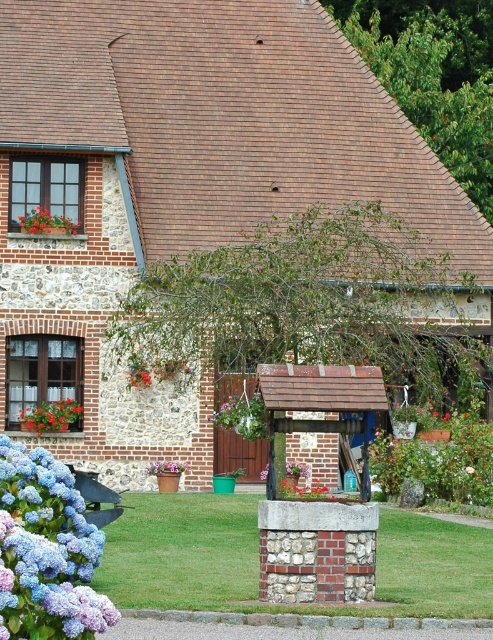
Question: Which object appears farthest from the camera in this image?

Choices:
 (A) green leafy bush at center
 (B) green grass at center
 (C) matte red flowers at upper left
 (D) purple matte hydrangea at lower left

Answer: (C)

Question: Does purple matte hydrangea at lower left lie in front of pink fabric flower at lower center?

Choices:
 (A) yes
 (B) no

Answer: (A)

Question: Can you confirm if matte red flowers at upper left is bigger than pink fabric flower at lower center?

Choices:
 (A) no
 (B) yes

Answer: (B)

Question: Which object is positioned farthest from the green leafy bush at center?

Choices:
 (A) green grass at center
 (B) matte red flowers at upper left
 (C) pink fabric flower at lower center

Answer: (B)

Question: Can you confirm if matte red flowers at upper left is thinner than pink fabric flower at lower center?

Choices:
 (A) yes
 (B) no

Answer: (B)

Question: Which object appears closest to the camera in this image?

Choices:
 (A) green grass at center
 (B) matte red flower at lower left
 (C) green leafy bush at center

Answer: (A)